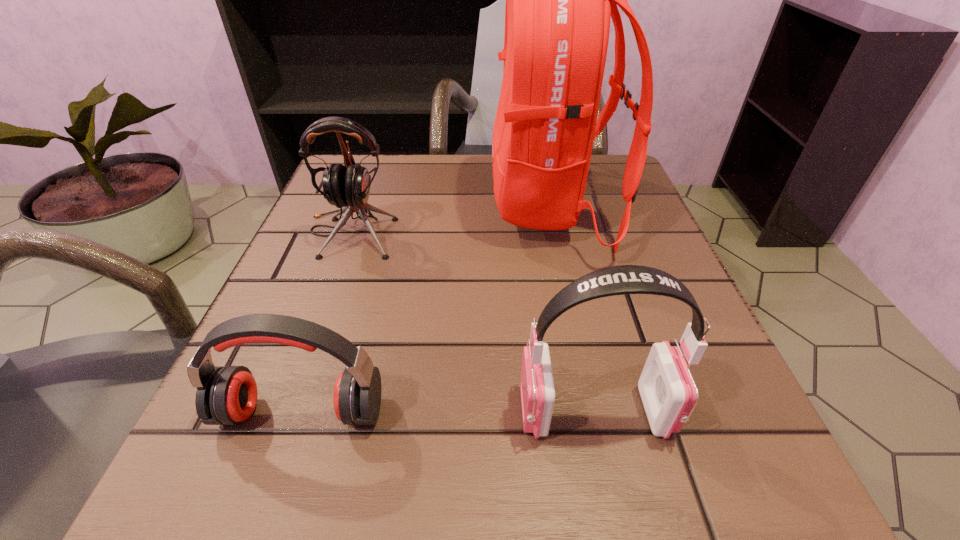
The width and height of the screenshot is (960, 540). Find the location of `vacant point located between the farthest earphone and the tallest object`. vacant point located between the farthest earphone and the tallest object is located at coordinates (451, 220).

I want to click on free spot between the shortest earphone and the tallest object, so click(x=426, y=309).

You are a GUI agent. You are given a task and a screenshot of the screen. Output one action in this format:
    pyautogui.click(x=<x>, y=<y>)
    Task: Click on the vacant space that's between the shortest earphone and the tallest object
    The height and width of the screenshot is (540, 960).
    Given the screenshot: What is the action you would take?
    pyautogui.click(x=426, y=309)

The height and width of the screenshot is (540, 960). What are the coordinates of `empty space that is in between the tallest object and the rightmost earphone` in the screenshot? It's located at (572, 309).

Where is `free space that is in between the shortest object and the backpack`? This screenshot has width=960, height=540. free space that is in between the shortest object and the backpack is located at coordinates (426, 309).

At what (x,y) coordinates should I click in order to perform the action: click on object identified as the third closest to the farthest earphone. Please return your answer as a coordinate pair (x, y). Image resolution: width=960 pixels, height=540 pixels. Looking at the image, I should click on (669, 394).

I want to click on the closest object to the tallest object, so click(x=348, y=186).

Identify which earphone is the second closest to the tallest object. Please provide its 2D coordinates. Your answer should be formatted as a tuple, i.e. [(x, y)], where the tuple contains the x and y coordinates of a point satisfying the conditions above.

[(669, 394)]

Identify which earphone is the second closest to the farthest earphone. Please provide its 2D coordinates. Your answer should be formatted as a tuple, i.e. [(x, y)], where the tuple contains the x and y coordinates of a point satisfying the conditions above.

[(669, 394)]

Locate an element on the screen. Image resolution: width=960 pixels, height=540 pixels. vacant space that satisfies the following two spatial constraints: 1. on the main compartment of the backpack; 2. on the ear cups of the shortest object is located at coordinates (595, 411).